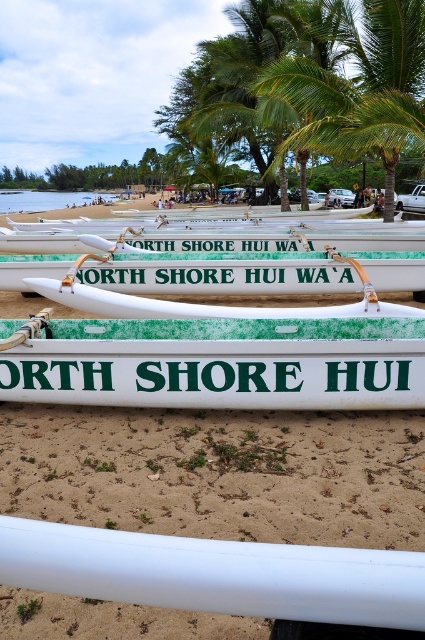
Where is `white plastic canoe at center`? The width and height of the screenshot is (425, 640). white plastic canoe at center is located at coordinates click(218, 474).

Locate an element on the screen. The height and width of the screenshot is (640, 425). white plastic canoe at center is located at coordinates (218, 474).

Can you confirm if white matte surfboard at center is bigger than green leafy palm tree at center?

Indeed, white matte surfboard at center has a larger size compared to green leafy palm tree at center.

Can you confirm if white matte surfboard at center is taller than green leafy palm tree at center?

Yes.

Image resolution: width=425 pixels, height=640 pixels. Find the location of `white matte surfboard at center`. white matte surfboard at center is located at coordinates (215, 362).

I want to click on white matte surfboard at center, so click(215, 362).

Is white plastic canoe at center bigger than white glossy canoe at center?

Indeed, white plastic canoe at center has a larger size compared to white glossy canoe at center.

I want to click on white plastic canoe at center, so click(x=218, y=474).

The image size is (425, 640). I want to click on white plastic canoe at center, so click(218, 474).